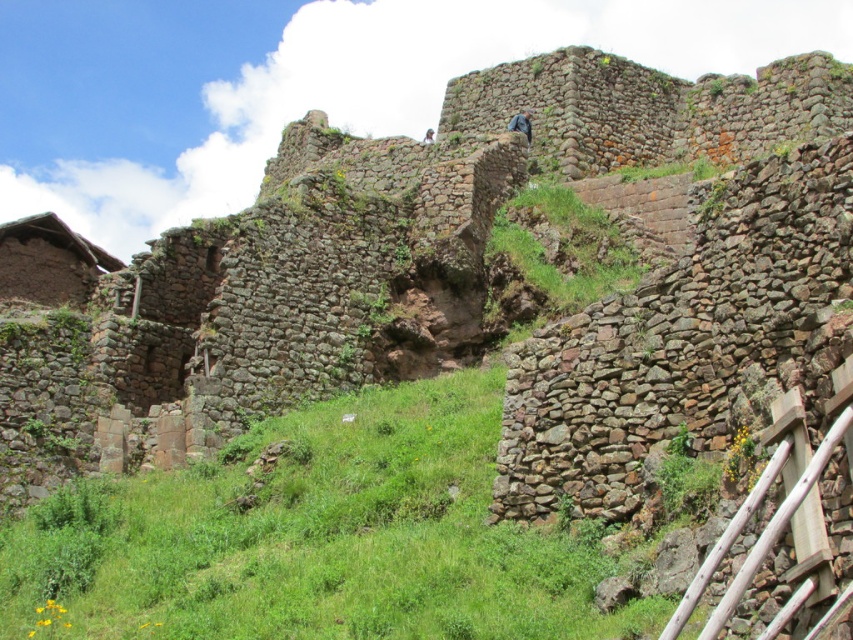
What do you see at coordinates (521, 124) in the screenshot? I see `blue fabric at upper center` at bounding box center [521, 124].

Which is more to the left, blue fabric at upper center or blue fabric person at upper center?

Positioned to the left is blue fabric person at upper center.

The image size is (853, 640). What do you see at coordinates (521, 124) in the screenshot?
I see `blue fabric at upper center` at bounding box center [521, 124].

You are a GUI agent. You are given a task and a screenshot of the screen. Output one action in this format:
    pyautogui.click(x=<x>, y=<y>)
    Task: Click on the blue fabric at upper center
    Image resolution: width=853 pixels, height=640 pixels.
    Given the screenshot: What is the action you would take?
    pyautogui.click(x=521, y=124)

Does green grassy at center appear on the left side of blue fabric person at upper center?

Correct, you'll find green grassy at center to the left of blue fabric person at upper center.

Does point (489, 611) come farther from viewer compared to point (422, 138)?

No, it is not.

You are a GUI agent. You are given a task and a screenshot of the screen. Output one action in this format:
    pyautogui.click(x=<x>, y=<y>)
    Task: Click on the green grassy at center
    
    Given the screenshot: What is the action you would take?
    pyautogui.click(x=318, y=538)

Does point (148, 586) lie behind point (521, 113)?

No, (148, 586) is in front of (521, 113).

Who is more distant from viewer, [439,417] or [514,120]?

Point [514,120]

This screenshot has height=640, width=853. Identify the location of green grassy at center. (318, 538).